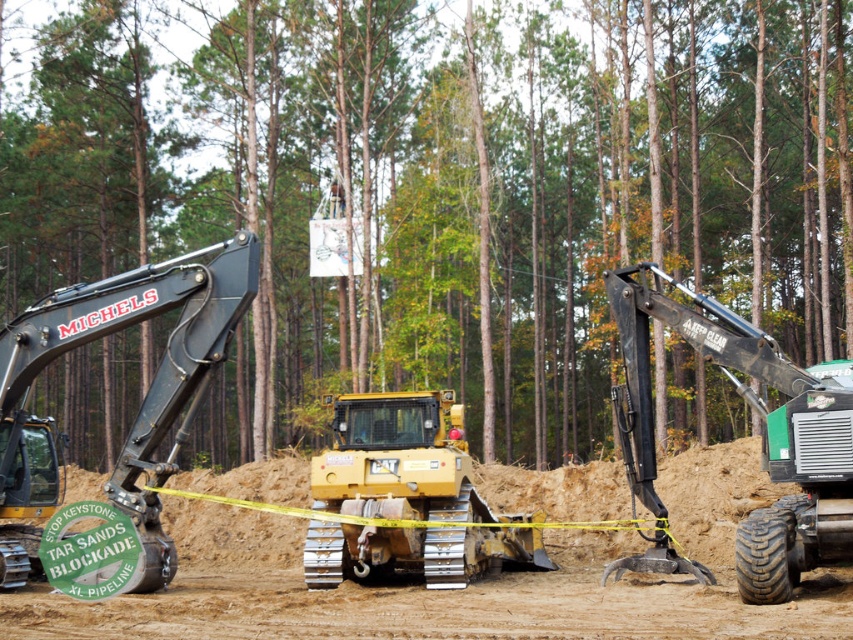
Consider the image. Which is below, green rubber tractor at right or yellow rubber tracked tractor at center?

yellow rubber tracked tractor at center

Can you confirm if green rubber tractor at right is positioned to the left of yellow rubber tracked tractor at center?

Incorrect, green rubber tractor at right is not on the left side of yellow rubber tracked tractor at center.

Where is `green rubber tractor at right`? The height and width of the screenshot is (640, 853). green rubber tractor at right is located at coordinates (762, 426).

Is yellow rubber tracked vehicle at center further to camera compared to matte black excavator at left?

No, it is not.

Who is positioned more to the left, yellow rubber tracked vehicle at center or matte black excavator at left?

From the viewer's perspective, matte black excavator at left appears more on the left side.

Is point (415, 477) closer to viewer compared to point (62, 321)?

No, it is behind (62, 321).

Locate an element on the screen. yellow rubber tracked vehicle at center is located at coordinates (368, 588).

Does green leafy tree at center appear on the right side of green rubber tractor at right?

Incorrect, green leafy tree at center is not on the right side of green rubber tractor at right.

Who is more forward, (619, 176) or (642, 300)?

Positioned in front is point (642, 300).

Image resolution: width=853 pixels, height=640 pixels. Find the location of `green leafy tree at center`. green leafy tree at center is located at coordinates (453, 189).